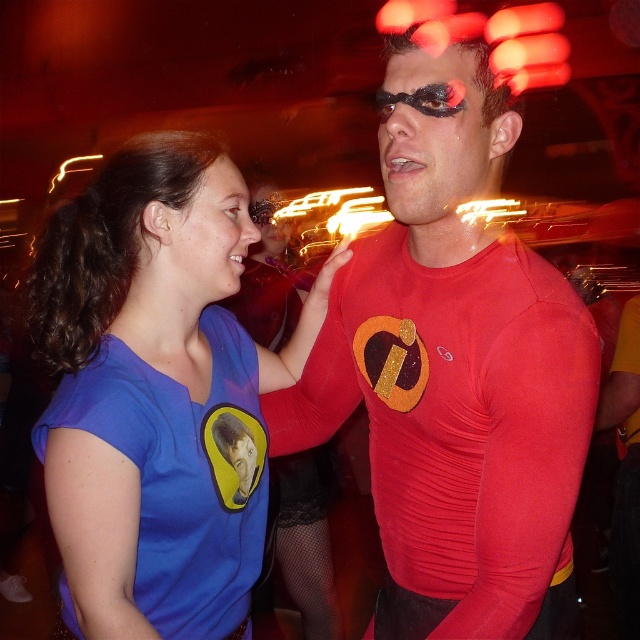
Question: Does red spandex shirt at center have a greater width compared to matte blue shirt at left?

Choices:
 (A) no
 (B) yes

Answer: (B)

Question: Can you confirm if matte red mask at center is wider than matte blue shirt at left?

Choices:
 (A) yes
 (B) no

Answer: (B)

Question: Is blue fabric shirt at left further to camera compared to matte blue shirt at left?

Choices:
 (A) no
 (B) yes

Answer: (A)

Question: Among these points, which one is farthest from the camera?

Choices:
 (A) (236, 348)
 (B) (198, 294)
 (C) (410, 164)
 (D) (388, 227)

Answer: (A)

Question: Which point appears farthest from the camera in this image?

Choices:
 (A) (132, 333)
 (B) (428, 84)
 (C) (460, 516)
 (D) (244, 186)

Answer: (D)

Question: Based on their relative distances, which object is nearer to the blue fabric shirt at left?

Choices:
 (A) matte blue shirt at left
 (B) matte red mask at center

Answer: (A)